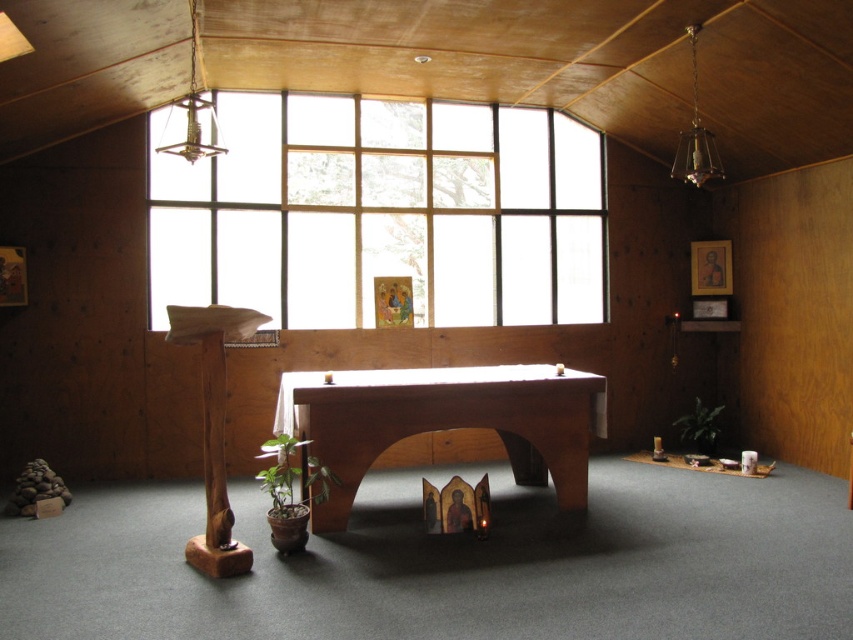
Is clear glass window at upper center to the left of wooden table at center from the viewer's perspective?

Indeed, clear glass window at upper center is positioned on the left side of wooden table at center.

Is point (463, 180) positioned before point (520, 458)?

No, (463, 180) is further to viewer.

Locate an element on the screen. clear glass window at upper center is located at coordinates (380, 211).